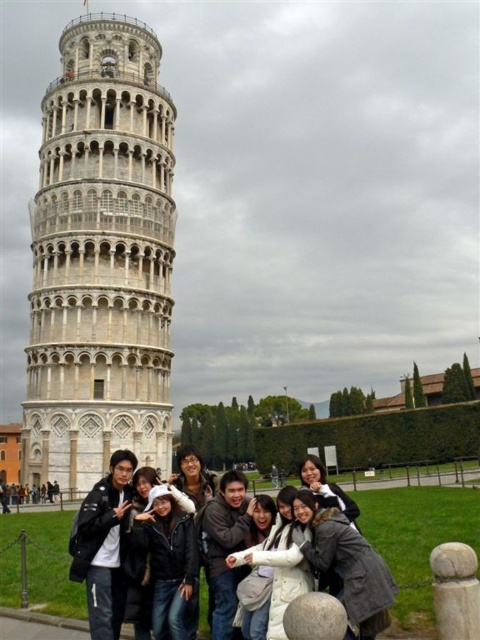
You are a photographer standing 10 feet away from the Leaning Tower of Pisa. You want to capture a photo of the black leather jacket at center and the white fleece jacket at center so that both are in frame. Given that your camera has a maximum zoom range of 10 feet, can you fit both jackets in the photo without moving closer?

The distance between the black leather jacket at center and the white fleece jacket at center is 18.28 feet. Since your camera can only zoom up to 10 feet, you cannot fit both jackets in the photo without moving closer because the distance between them exceeds the camera range.

You are standing at the point marked as point (100, 259) in the image. What famous landmark can you see directly in front of you?

The white marble tower at center is located at point (100, 259), so you can see the Leaning Tower of Pisa directly in front of you.